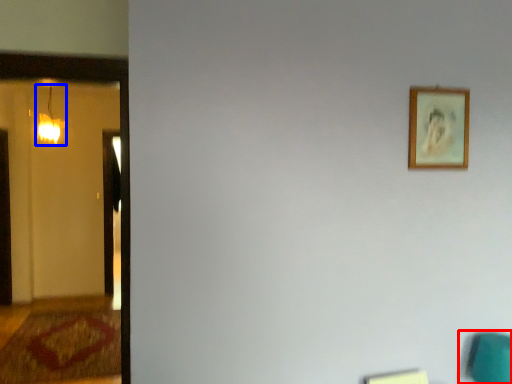
Question: Which point is further to the camera, swivel chair (highlighted by a red box) or lamp (highlighted by a blue box)?

Choices:
 (A) swivel chair
 (B) lamp

Answer: (B)